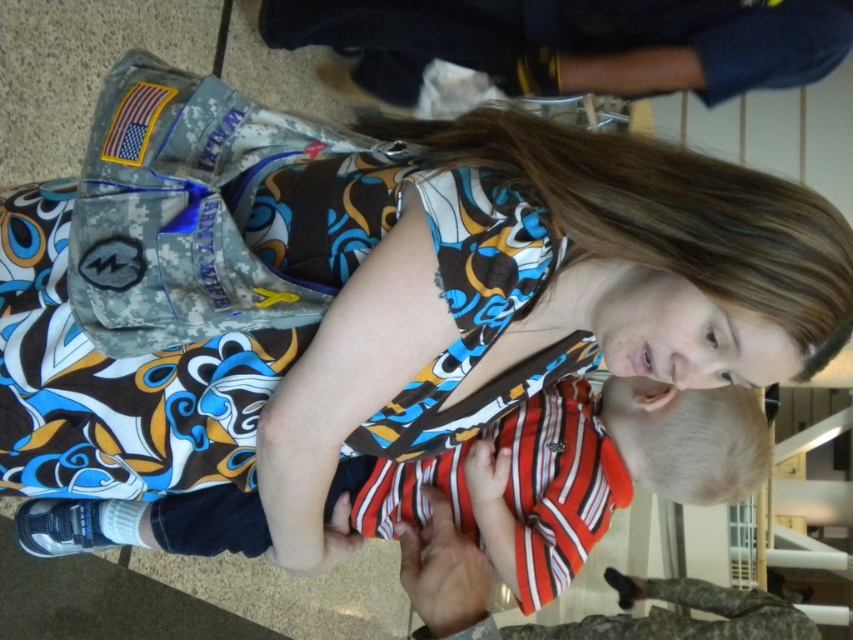
Question: In this image, where is printed fabric dress at center located relative to striped cotton shirt at center?

Choices:
 (A) below
 (B) above

Answer: (B)

Question: Can you confirm if printed fabric dress at center is bigger than striped cotton shirt at center?

Choices:
 (A) no
 (B) yes

Answer: (A)

Question: Can you confirm if printed fabric dress at center is positioned above striped cotton shirt at center?

Choices:
 (A) yes
 (B) no

Answer: (A)

Question: Which object appears farthest from the camera in this image?

Choices:
 (A) printed fabric dress at center
 (B) striped cotton shirt at center

Answer: (B)

Question: Which object appears farthest from the camera in this image?

Choices:
 (A) printed fabric dress at center
 (B) striped cotton shirt at center

Answer: (B)